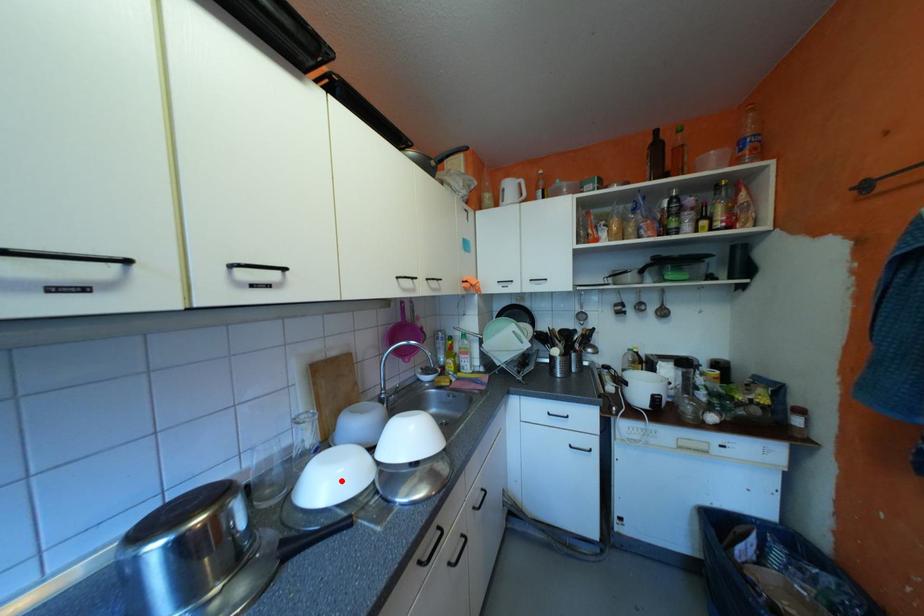
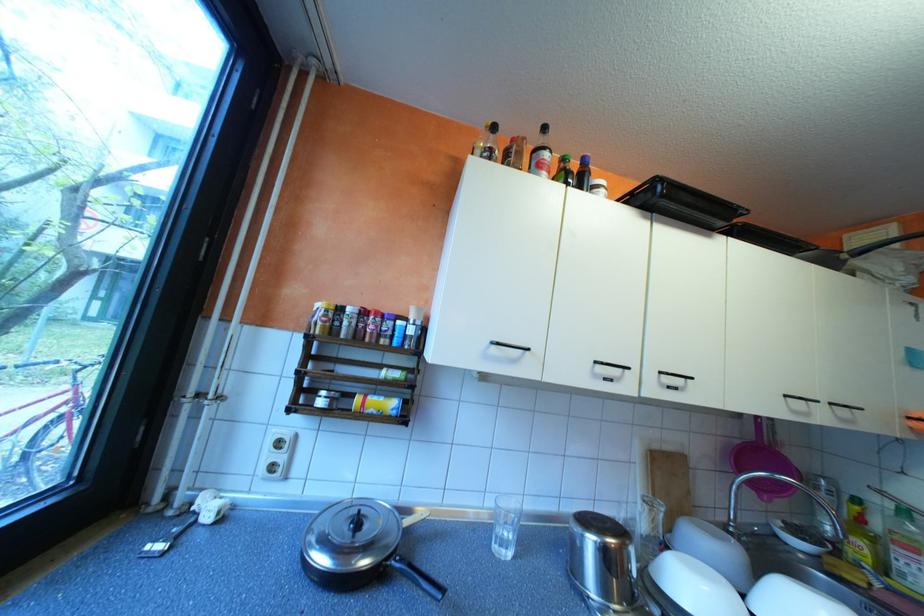
Locate, in the second image, the point that corresponds to the highlighted location in the first image.

(709, 592)